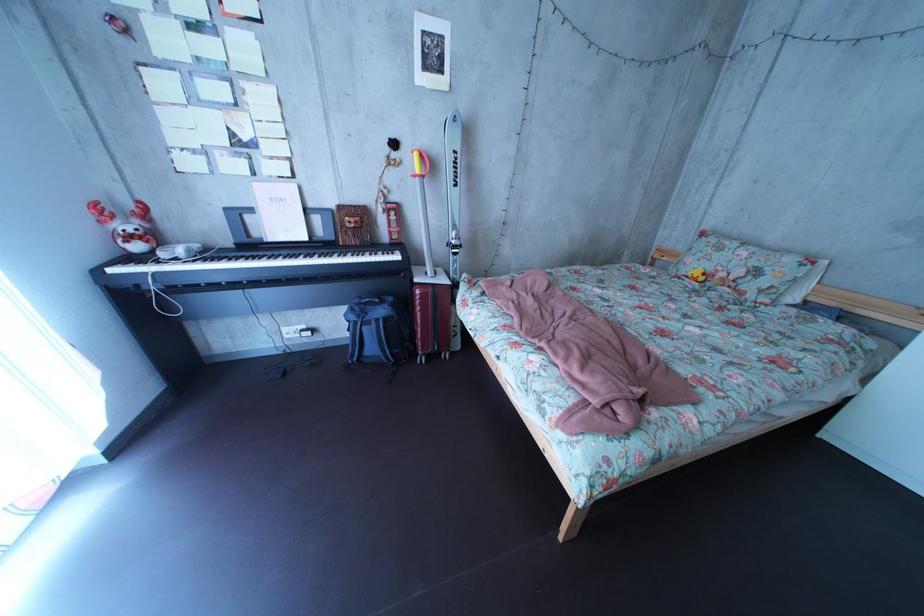
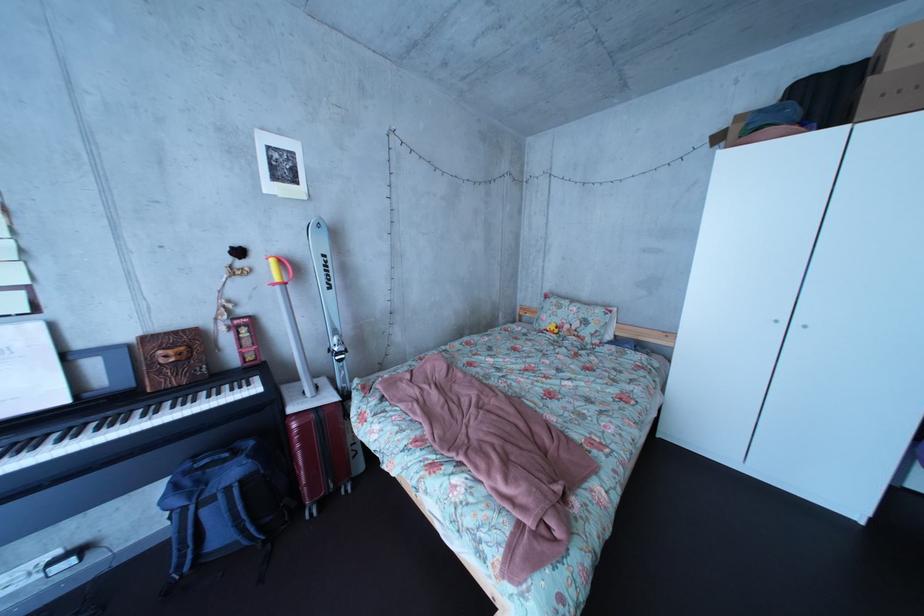
In a continuous first-person perspective shot, in which direction is the camera moving?

The movement direction of the cameraman is right, forward.